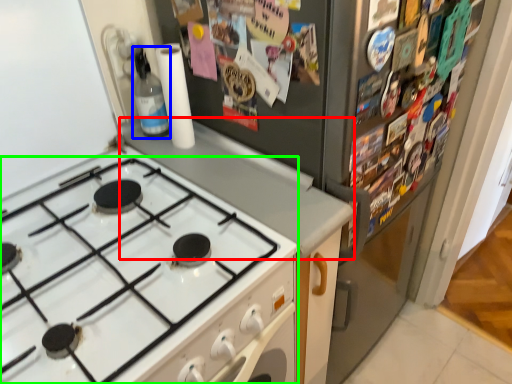
Question: Estimate the real-world distances between objects in this image. Which object is farther from counter top (highlighted by a red box), bottle (highlighted by a blue box) or gas stove (highlighted by a green box)?

Choices:
 (A) bottle
 (B) gas stove

Answer: (A)